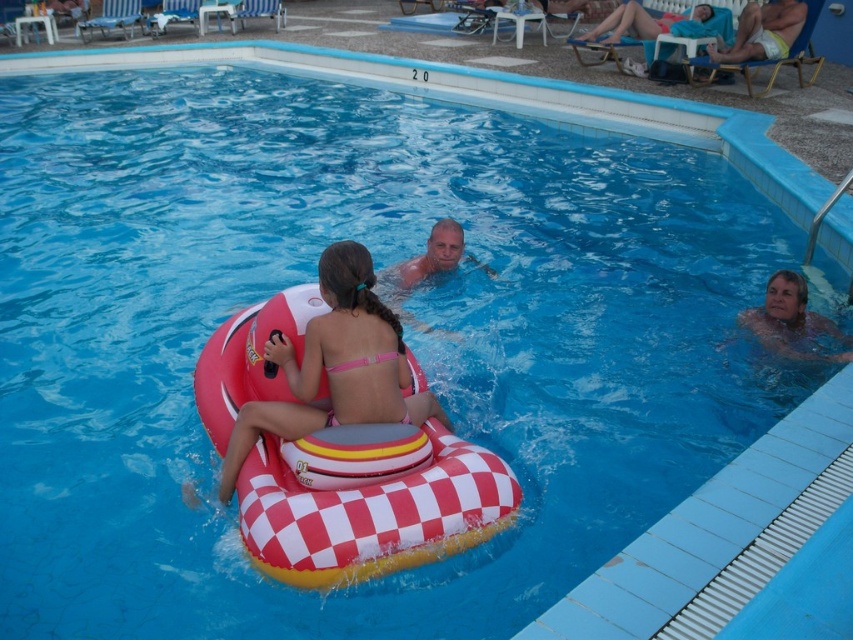
Question: Does smooth skin man at right have a larger size compared to white cotton shorts at upper right?

Choices:
 (A) no
 (B) yes

Answer: (A)

Question: Which point is farther from the camera taking this photo?

Choices:
 (A) (775, 13)
 (B) (596, 33)
 (C) (798, 305)
 (D) (268, 337)

Answer: (B)

Question: Does white cotton shorts at upper right appear under blue fabric towel at upper right?

Choices:
 (A) no
 (B) yes

Answer: (B)

Question: Which of the following is the closest to the observer?

Choices:
 (A) smooth skin man at right
 (B) matte pink bikini at center
 (C) white cotton shorts at upper right
 (D) blue fabric towel at upper right

Answer: (B)

Question: Which point is closer to the camera?

Choices:
 (A) smooth skin man at right
 (B) matte pink bikini at center

Answer: (B)

Question: From the image, what is the correct spatial relationship of matte pink bikini at center in relation to smooth skin man at right?

Choices:
 (A) above
 (B) below

Answer: (B)